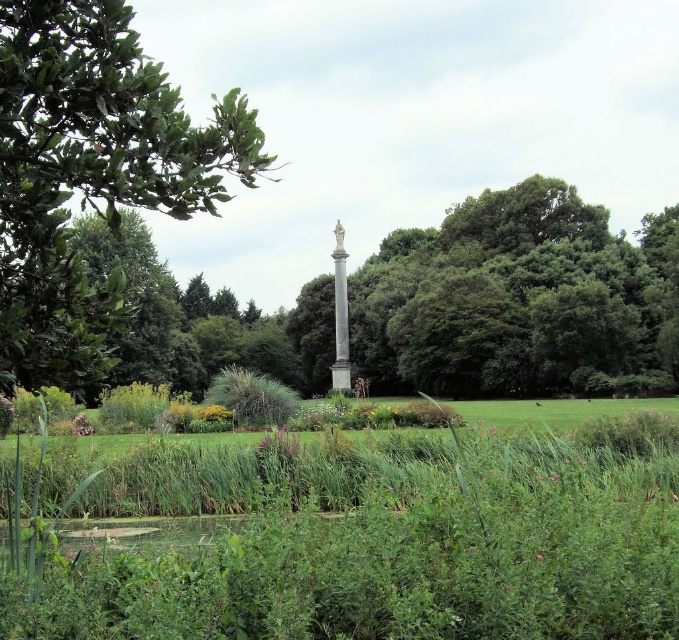
Question: Is green grassy field at center positioned in front of green leafy tree at upper left?

Choices:
 (A) no
 (B) yes

Answer: (B)

Question: Can you confirm if green grassy field at center is positioned to the right of white marble column at center?

Choices:
 (A) yes
 (B) no

Answer: (A)

Question: Which object appears farthest from the camera in this image?

Choices:
 (A) green grassy field at center
 (B) white marble column at center
 (C) green leafy tree at upper left

Answer: (B)

Question: Which of these objects is positioned closest to the green leafy tree at upper left?

Choices:
 (A) green grassy field at center
 (B) white marble column at center

Answer: (A)

Question: In this image, where is green leafy tree at upper left located relative to white marble column at center?

Choices:
 (A) above
 (B) below

Answer: (A)

Question: Based on their relative distances, which object is nearer to the green grassy field at center?

Choices:
 (A) green leafy tree at upper left
 (B) white marble column at center

Answer: (A)